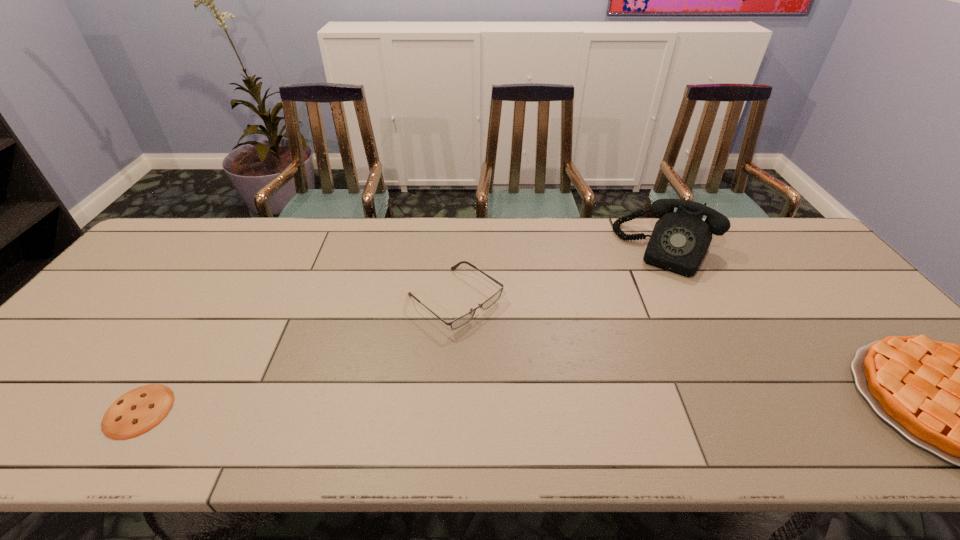
At what (x,y) coordinates should I click in order to perform the action: click on the shortest object. Please return your answer as a coordinate pair (x, y). The image size is (960, 540). Looking at the image, I should click on (137, 411).

The height and width of the screenshot is (540, 960). I want to click on the leftmost object, so click(137, 411).

At what (x,y) coordinates should I click in order to perform the action: click on the third object from right to left. Please return your answer as a coordinate pair (x, y). The width and height of the screenshot is (960, 540). Looking at the image, I should click on (464, 319).

Image resolution: width=960 pixels, height=540 pixels. I want to click on spectacles, so click(x=464, y=319).

This screenshot has width=960, height=540. I want to click on the third object from left to right, so click(x=680, y=240).

Image resolution: width=960 pixels, height=540 pixels. I want to click on telephone, so click(x=680, y=240).

This screenshot has height=540, width=960. Identify the location of vacant region located on the right of the cookie. (249, 411).

You are a GUI agent. You are given a task and a screenshot of the screen. Output one action in this format:
    pyautogui.click(x=<x>, y=<y>)
    Task: Click on the free space located 0.100m on the front-facing side of the third tallest object
    This screenshot has width=960, height=540.
    Given the screenshot: What is the action you would take?
    pyautogui.click(x=517, y=347)

Where is `vacant space situated 0.180m on the front-facing side of the third tallest object`? The height and width of the screenshot is (540, 960). vacant space situated 0.180m on the front-facing side of the third tallest object is located at coordinates (542, 365).

Where is `free space located 0.190m on the front-facing side of the third tallest object`? Image resolution: width=960 pixels, height=540 pixels. free space located 0.190m on the front-facing side of the third tallest object is located at coordinates (546, 368).